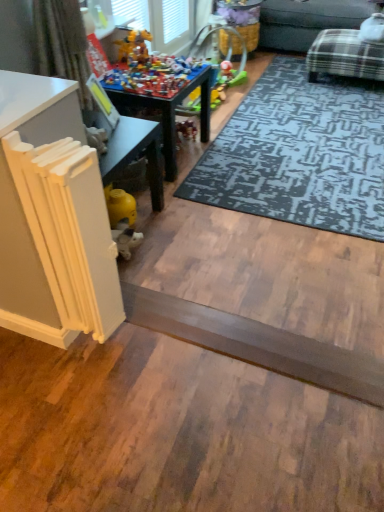
Question: Relative to dark gray textured rug at center, is smooth gray plank at center in front or behind?

Choices:
 (A) behind
 (B) front

Answer: (B)

Question: Based on their sizes in the image, would you say smooth gray plank at center is bigger or smaller than dark gray textured rug at center?

Choices:
 (A) big
 (B) small

Answer: (B)

Question: Estimate the real-world distances between objects in this image. Which object is farther from the multicolored plastic toys at center?

Choices:
 (A) white fabric curtain at upper left
 (B) plaid fabric couch at upper right
 (C) smooth gray plank at center
 (D) dark gray textured rug at center
 (E) white painted wood table at lower left, arranged as the first table when ordered from the bottom

Answer: (B)

Question: Considering the real-world distances, which object is closest to the plaid fabric couch at upper right?

Choices:
 (A) multicolored plastic toys at center
 (B) wooden toy table at center, arranged as the first table when viewed from the top
 (C) smooth gray plank at center
 (D) white fabric curtain at upper left
 (E) dark gray textured rug at center

Answer: (E)